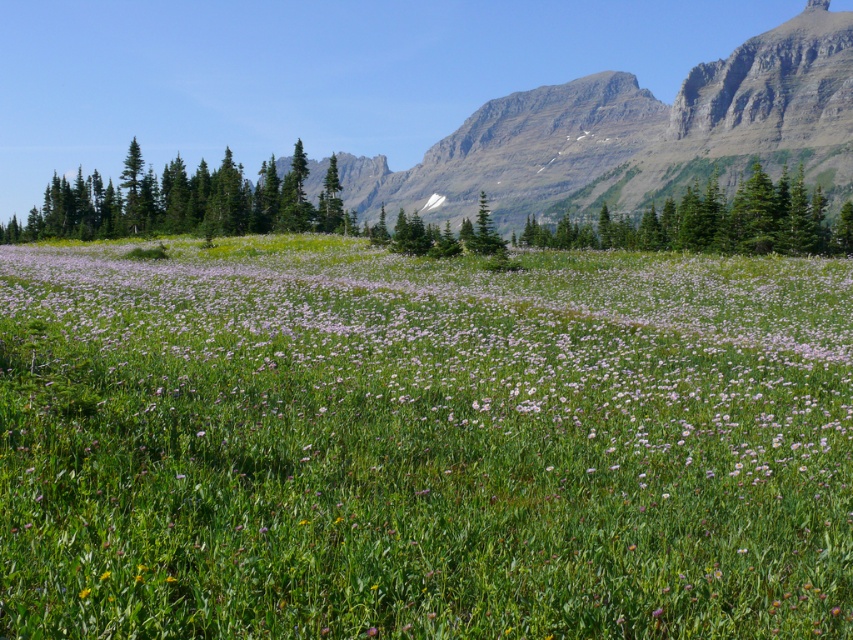
Between pink soft grass at center and green textured pine tree at center, which one has more height?

green textured pine tree at center is taller.

At what (x,y) coordinates should I click in order to perform the action: click on pink soft grass at center. Please return your answer as a coordinate pair (x, y). Looking at the image, I should click on (421, 442).

Who is more distant from viewer, (523, 547) or (711, 246)?

The point (711, 246) is more distant.

Identify the location of pink soft grass at center. (421, 442).

This screenshot has width=853, height=640. What do you see at coordinates (181, 202) in the screenshot?
I see `green matte trees at left` at bounding box center [181, 202].

Looking at this image, is green matte trees at left to the right of green textured pine tree at center from the viewer's perspective?

In fact, green matte trees at left is to the left of green textured pine tree at center.

Who is more distant from viewer, (96, 186) or (817, 186)?

Point (817, 186)

What are the coordinates of `green matte trees at left` in the screenshot? It's located at (181, 202).

Who is positioned more to the right, green textured pine tree at center or green matte tree at center?

green textured pine tree at center

Does green textured pine tree at center lie behind green matte tree at center?

No, it is not.

Who is more distant from viewer, (762, 205) or (329, 212)?

The point (329, 212) is behind.

You are a GUI agent. You are given a task and a screenshot of the screen. Output one action in this format:
    pyautogui.click(x=<x>, y=<y>)
    Task: Click on the green textured pine tree at center
    The width and height of the screenshot is (853, 640).
    Given the screenshot: What is the action you would take?
    pyautogui.click(x=714, y=221)